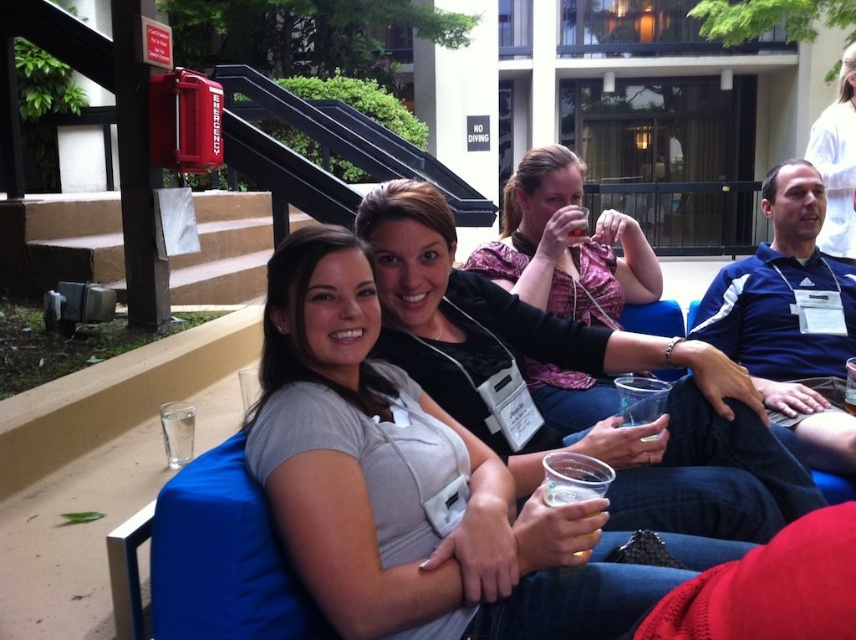
Question: Which object is positioned closest to the brown concrete stairs at left?

Choices:
 (A) matte pink sweater at center
 (B) matte black jacket at center

Answer: (A)

Question: Is matte pink sweater at center thinner than translucent plastic cup at lower center?

Choices:
 (A) yes
 (B) no

Answer: (B)

Question: Is matte black jacket at center positioned before matte pink sweater at center?

Choices:
 (A) yes
 (B) no

Answer: (A)

Question: Which of the following is the farthest from the observer?

Choices:
 (A) brown concrete stairs at left
 (B) translucent plastic cup at lower center

Answer: (A)

Question: Based on their relative distances, which object is farther from the translucent plastic cup at lower center?

Choices:
 (A) matte black jacket at center
 (B) matte pink sweater at center
 (C) brown concrete stairs at left

Answer: (C)

Question: From the image, what is the correct spatial relationship of brown concrete stairs at left in relation to translucent plastic cup at lower center?

Choices:
 (A) right
 (B) left

Answer: (B)